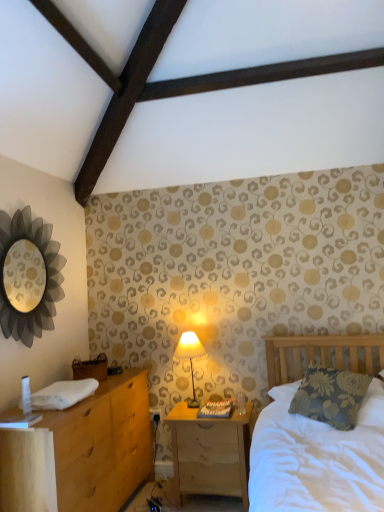
Question: Considering the relative positions of matte cream fabric lampshade at center and metallic silver mirror at upper left in the image provided, is matte cream fabric lampshade at center to the right of metallic silver mirror at upper left from the viewer's perspective?

Choices:
 (A) yes
 (B) no

Answer: (A)

Question: Is matte cream fabric lampshade at center looking in the opposite direction of metallic silver mirror at upper left?

Choices:
 (A) yes
 (B) no

Answer: (B)

Question: Is matte cream fabric lampshade at center far away from metallic silver mirror at upper left?

Choices:
 (A) yes
 (B) no

Answer: (A)

Question: Considering the relative sizes of matte cream fabric lampshade at center and metallic silver mirror at upper left in the image provided, is matte cream fabric lampshade at center bigger than metallic silver mirror at upper left?

Choices:
 (A) yes
 (B) no

Answer: (B)

Question: Considering the relative sizes of matte cream fabric lampshade at center and metallic silver mirror at upper left in the image provided, is matte cream fabric lampshade at center thinner than metallic silver mirror at upper left?

Choices:
 (A) no
 (B) yes

Answer: (A)

Question: Is matte cream fabric lampshade at center positioned before metallic silver mirror at upper left?

Choices:
 (A) no
 (B) yes

Answer: (A)

Question: From the image's perspective, does metallic silver mirror at upper left appear higher than floral fabric pillow at right?

Choices:
 (A) yes
 (B) no

Answer: (A)

Question: Is metallic silver mirror at upper left smaller than floral fabric pillow at right?

Choices:
 (A) yes
 (B) no

Answer: (A)

Question: Can you confirm if metallic silver mirror at upper left is positioned to the right of floral fabric pillow at right?

Choices:
 (A) no
 (B) yes

Answer: (A)

Question: Is metallic silver mirror at upper left positioned far away from floral fabric pillow at right?

Choices:
 (A) no
 (B) yes

Answer: (B)

Question: Considering the relative sizes of metallic silver mirror at upper left and floral fabric pillow at right in the image provided, is metallic silver mirror at upper left thinner than floral fabric pillow at right?

Choices:
 (A) yes
 (B) no

Answer: (A)

Question: From a real-world perspective, is metallic silver mirror at upper left over floral fabric pillow at right?

Choices:
 (A) no
 (B) yes

Answer: (B)

Question: Is metallic silver mirror at upper left to the left of matte cream fabric lampshade at center from the viewer's perspective?

Choices:
 (A) no
 (B) yes

Answer: (B)